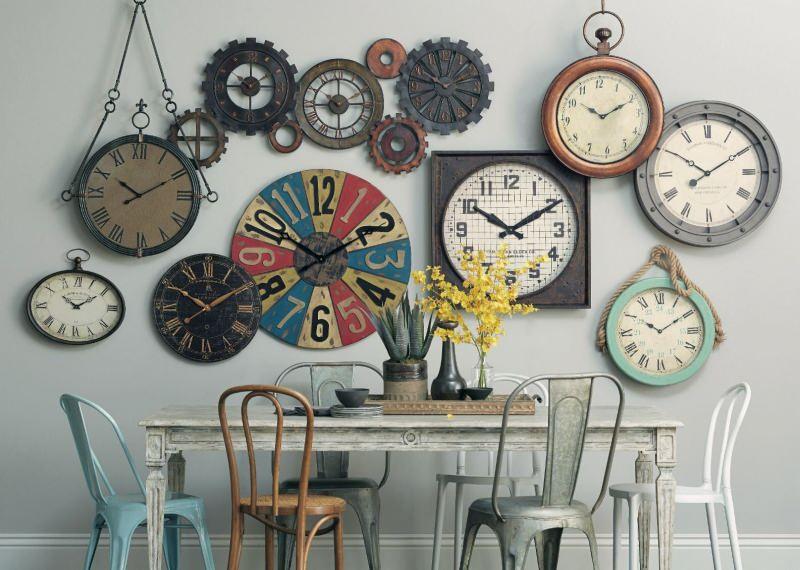
At what (x,y) coordinates should I click in order to perform the action: click on clocks with roman numerals. Please return your answer as a coordinate pair (x, y). Looking at the image, I should click on (88, 314), (177, 321), (132, 201), (700, 181), (668, 320), (348, 83).